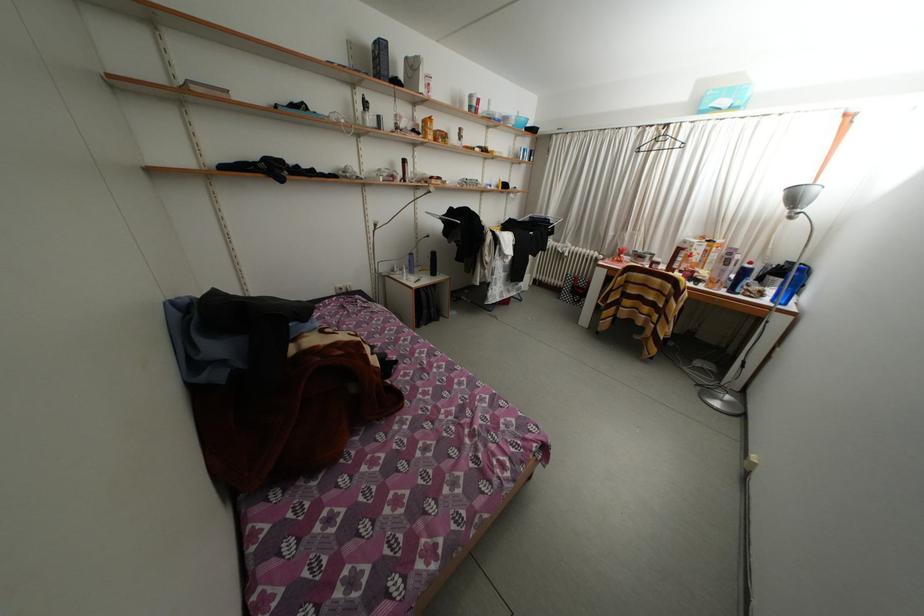
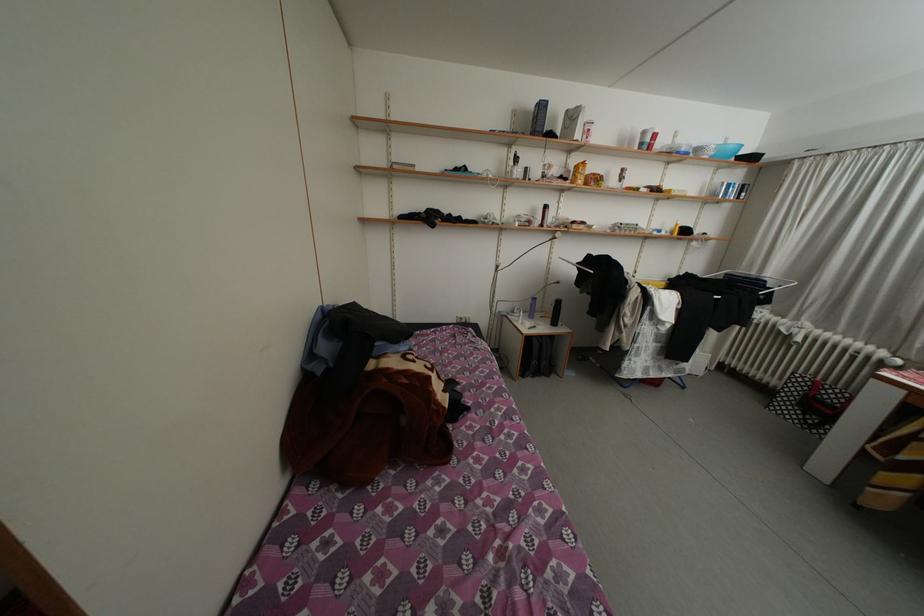
In the second image, find the point that corresponds to (432,127) in the first image.

(584, 172)